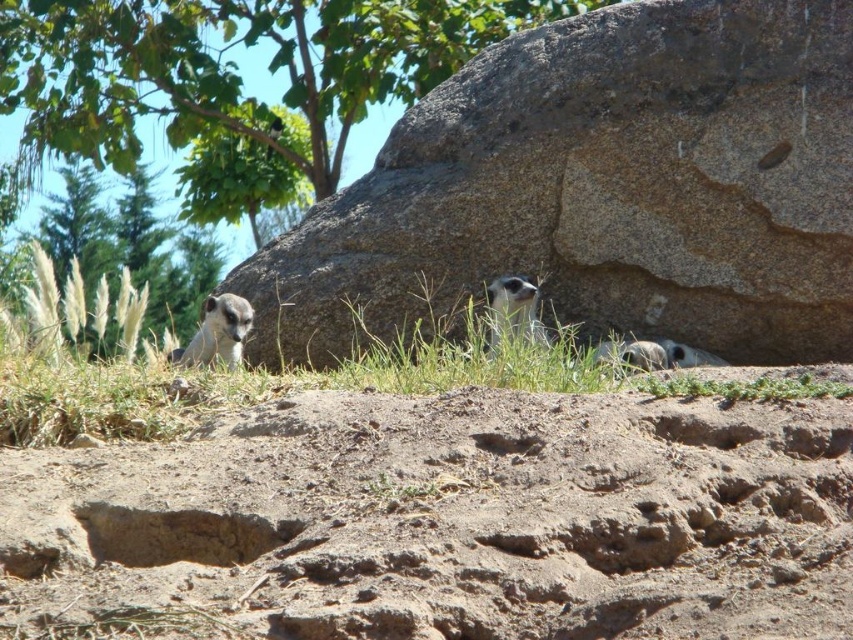
Does point (543, 81) come closer to viewer compared to point (135, 104)?

That is True.

Which of these two, gray rough rock at center or green leafy tree at upper center, stands shorter?

gray rough rock at center

Is point (543, 145) positioned behind point (115, 61)?

No, (543, 145) is in front of (115, 61).

Locate an element on the screen. gray rough rock at center is located at coordinates (601, 189).

Between point (656, 328) and point (776, 144), which one is positioned behind?

The point (656, 328) is behind.

How distant is gray rough rock at center from smooth stone hole at upper right?

They are 31.90 inches apart.

Find the location of a particular element. gray rough rock at center is located at coordinates (601, 189).

Based on the photo, can you confirm if green grass at center is positioned to the left of gray fur meerkat at center?

Indeed, green grass at center is positioned on the left side of gray fur meerkat at center.

Between green grass at center and gray fur meerkat at center, which one has less height?

With less height is gray fur meerkat at center.

Between point (459, 378) and point (498, 280), which one is positioned in front?

Point (459, 378) is more forward.

Identify the location of green grass at center. (316, 385).